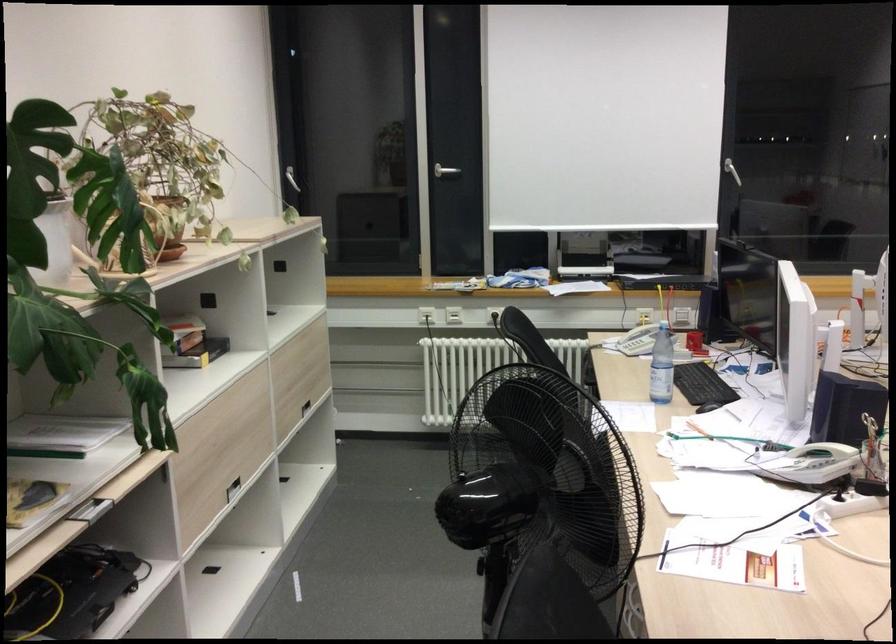
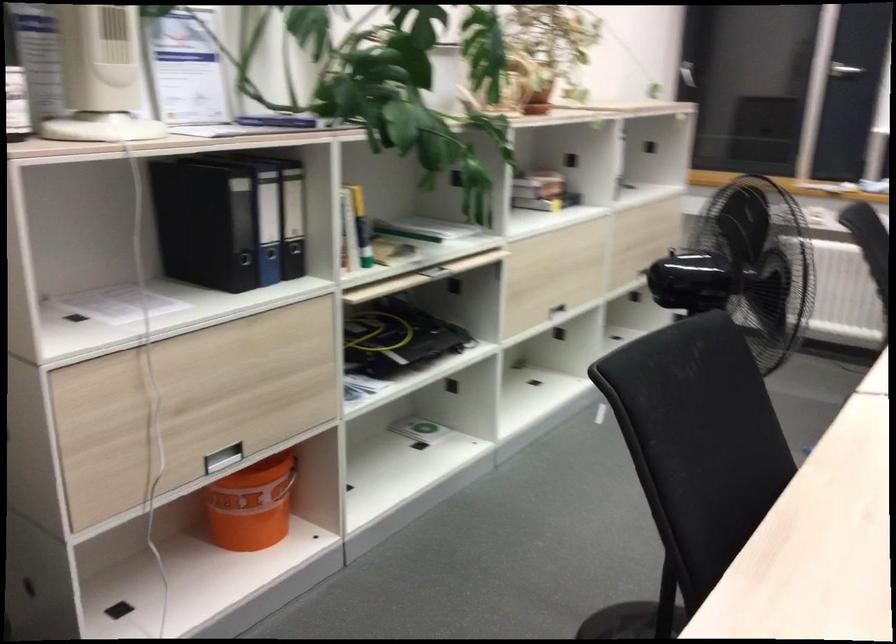
Question: The camera is either moving clockwise (left) or counter-clockwise (right) around the object. The first image is from the beginning of the video and the second image is from the end. Is the camera moving left or right when shooting the video?

Choices:
 (A) Left
 (B) Right

Answer: (B)